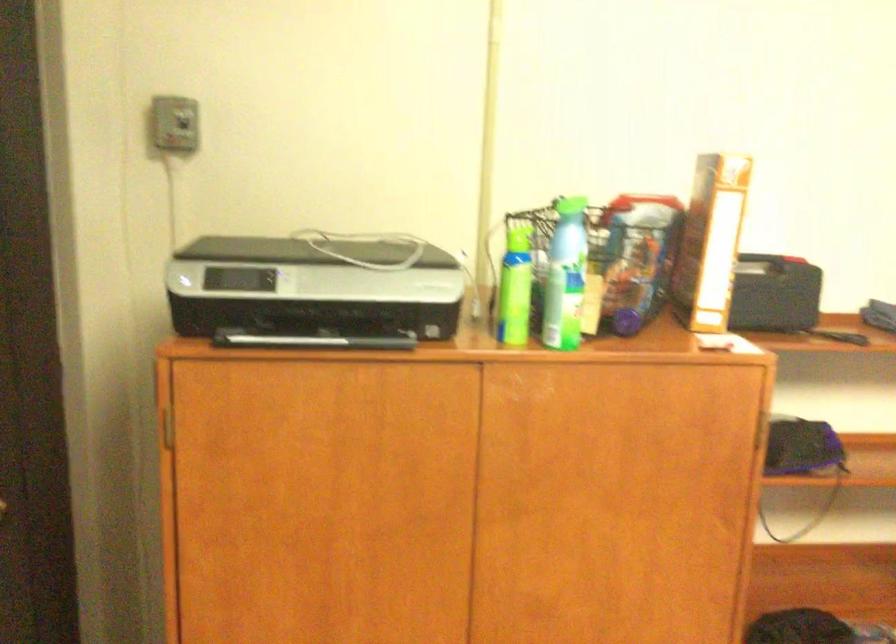
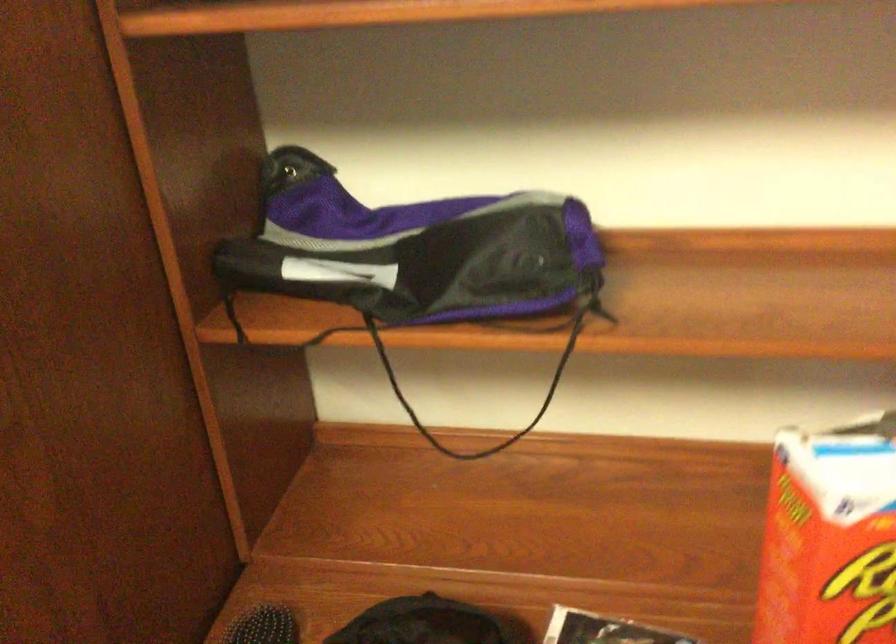
In a continuous first-person perspective shot, in which direction is the camera moving?

The cameraman moved toward right, forward.